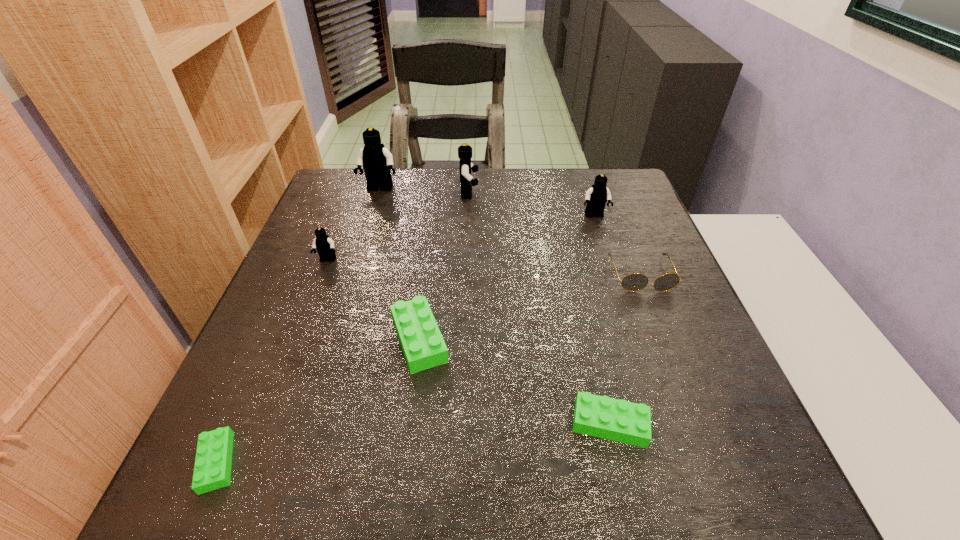
Find the location of a particular element. The image size is (960, 540). vacant space located 0.070m on the left of the third nearest Lego is located at coordinates (353, 339).

Where is `free space located 0.240m on the left of the rightmost green Lego`? free space located 0.240m on the left of the rightmost green Lego is located at coordinates (429, 424).

This screenshot has width=960, height=540. In order to click on vacant area located 0.190m on the back of the leftmost green Lego in this screenshot , I will do `click(270, 343)`.

The height and width of the screenshot is (540, 960). I want to click on object situated at the near edge, so click(212, 470).

Identify the location of Lego that is at the right edge. (596, 197).

This screenshot has height=540, width=960. I want to click on sunglasses situated at the right edge, so [634, 282].

Image resolution: width=960 pixels, height=540 pixels. In order to click on object that is at the far left corner in this screenshot , I will do `click(377, 161)`.

Locate an element on the screen. object that is positioned at the near left corner is located at coordinates (212, 470).

This screenshot has height=540, width=960. Identify the location of object located in the far right corner section of the desktop. coord(596,197).

You are a GUI agent. You are given a task and a screenshot of the screen. Output one action in this format:
    pyautogui.click(x=<x>, y=<y>)
    Task: Click on the free space at the far edge of the desktop
    This screenshot has width=960, height=540.
    Given the screenshot: What is the action you would take?
    pyautogui.click(x=485, y=170)